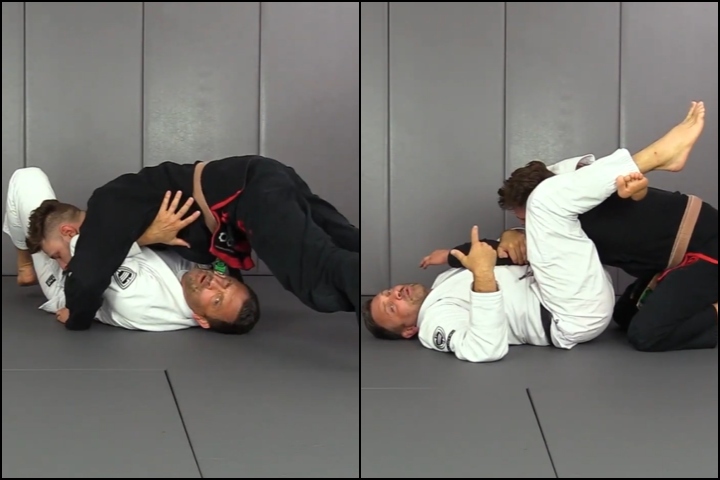
Where is `mats`? The height and width of the screenshot is (480, 720). mats is located at coordinates (422, 430), (636, 421), (288, 417), (119, 423).